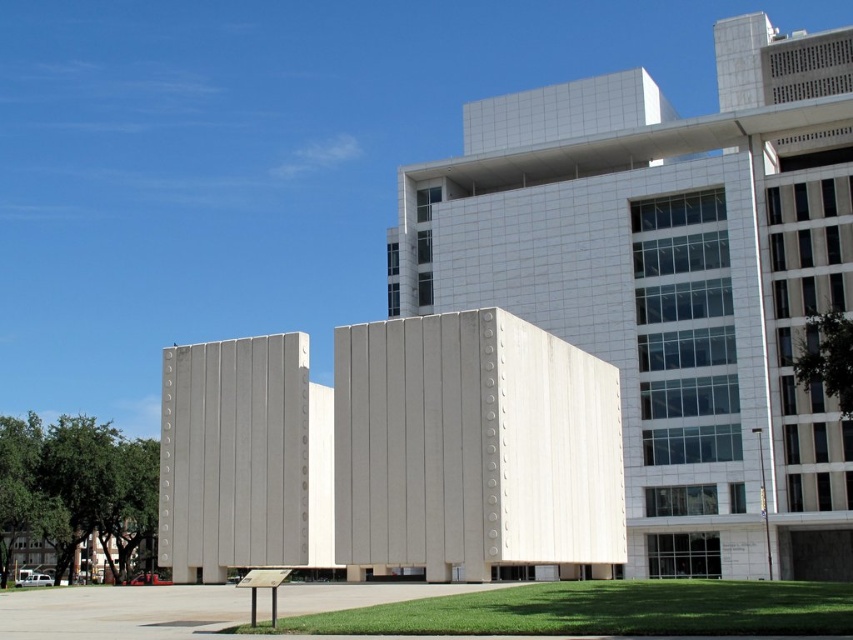
You are an architect evaluating two buildings in the image. The smooth concrete building at center and the white concrete building at center. Which one has a larger footprint?

The smooth concrete building at center is bigger than the white concrete building at center, so it has a larger footprint.

You are an architect analyzing the building depicted in the image. You notice two distinct sections labeled as the smooth concrete building at center and the white concrete building at center. Based on the structure, which one is positioned higher up in the building?

The smooth concrete building at center is located above the white concrete building at center, so it is positioned higher up in the building.

Looking at this image, you are an architect reviewing a design blueprint. The blueprint shows a modern building with two sections at the center. One is labeled as the smooth concrete building at center and the other as the white concrete building at center. According to the blueprint, which section is taller?

The smooth concrete building at center is taller than the white concrete building at center according to the blueprint.